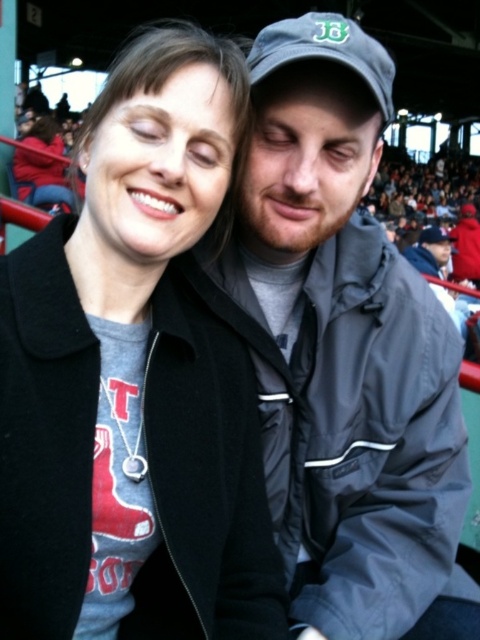
You are a photographer at a baseball game and want to take a photo focusing on the gray matte jacket at center and the gray fabric jacket at center. Which jacket will appear larger in your photo?

The gray matte jacket at center will appear larger in the photo because it is closer to the viewer than the gray fabric jacket at center.

You are at a baseball game and need to find the gray matte jacket at center. Which direction should you look from the matte gray sweatshirt at upper left?

The gray matte jacket at center is to the right of the matte gray sweatshirt at upper left, so you should look to the right from the matte gray sweatshirt at upper left to find it.